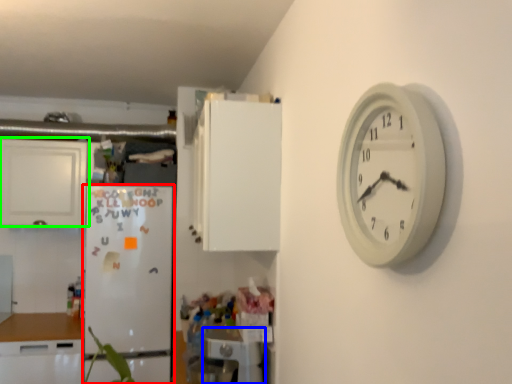
Question: Which is nearer to the fridge (highlighted by a red box)? appliance (highlighted by a blue box) or cabinetry (highlighted by a green box).

Choices:
 (A) appliance
 (B) cabinetry

Answer: (B)